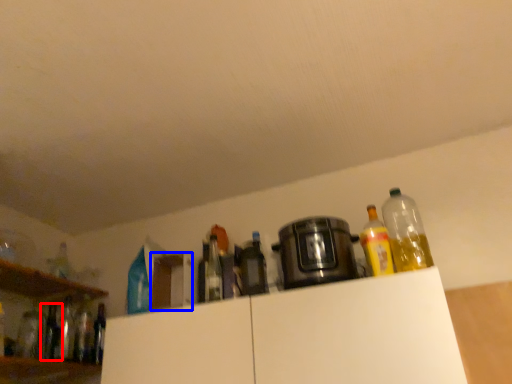
Question: Which point is closer to the camera, bottle (highlighted by a red box) or cabinetry (highlighted by a blue box)?

Choices:
 (A) bottle
 (B) cabinetry

Answer: (B)